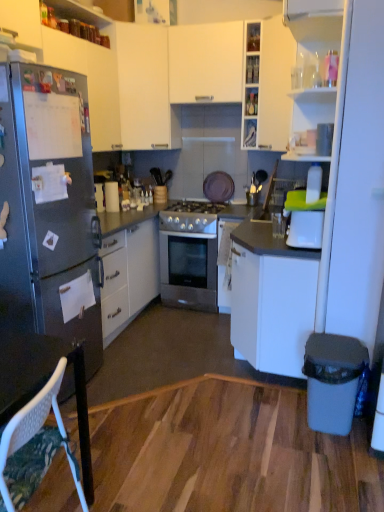
Question: From a real-world perspective, is white plastic trash can at lower right beneath white matte cabinet at upper center, which is the 1th cabinetry in right-to-left order?

Choices:
 (A) yes
 (B) no

Answer: (A)

Question: Is white matte cabinet at upper center, which is counted as the 4th cabinetry, starting from the left, located within white plastic trash can at lower right?

Choices:
 (A) yes
 (B) no

Answer: (B)

Question: Can you confirm if white plastic trash can at lower right is positioned to the left of white matte cabinet at upper center, which is counted as the 4th cabinetry, starting from the left?

Choices:
 (A) yes
 (B) no

Answer: (B)

Question: Would you say white plastic trash can at lower right is a long distance from white matte cabinet at upper center, which is the 1th cabinetry in right-to-left order?

Choices:
 (A) no
 (B) yes

Answer: (B)

Question: Is white plastic trash can at lower right oriented towards white matte cabinet at upper center, which is counted as the 4th cabinetry, starting from the left?

Choices:
 (A) no
 (B) yes

Answer: (A)

Question: In terms of size, does satin silver gas stove at center appear bigger or smaller than metallic silver cabinet at upper left, marked as the fourth cabinetry in a right-to-left arrangement?

Choices:
 (A) small
 (B) big

Answer: (A)

Question: Would you say satin silver gas stove at center is inside or outside metallic silver cabinet at upper left, the 1th cabinetry viewed from the left?

Choices:
 (A) outside
 (B) inside

Answer: (A)

Question: Is satin silver gas stove at center taller or shorter than metallic silver cabinet at upper left, marked as the fourth cabinetry in a right-to-left arrangement?

Choices:
 (A) tall
 (B) short

Answer: (B)

Question: Considering the relative positions of satin silver gas stove at center and metallic silver cabinet at upper left, the 1th cabinetry viewed from the left, in the image provided, is satin silver gas stove at center to the left or to the right of metallic silver cabinet at upper left, the 1th cabinetry viewed from the left,?

Choices:
 (A) right
 (B) left

Answer: (A)

Question: Choose the correct answer: Is clear glass bottles at upper center, the 1th shelf positioned from the top, inside clear glass shelf at upper center, the 1th shelf from the bottom, or outside it?

Choices:
 (A) inside
 (B) outside

Answer: (B)

Question: Would you say clear glass bottles at upper center, the 1th shelf positioned from the top, is to the left or to the right of clear glass shelf at upper center, marked as the second shelf in a top-to-bottom arrangement, in the picture?

Choices:
 (A) right
 (B) left

Answer: (B)

Question: From a real-world perspective, is clear glass bottles at upper center, the 1th shelf positioned from the top, physically located above or below clear glass shelf at upper center, marked as the second shelf in a top-to-bottom arrangement?

Choices:
 (A) above
 (B) below

Answer: (A)

Question: Is clear glass bottles at upper center, the 1th shelf positioned from the top, in front of or behind clear glass shelf at upper center, marked as the second shelf in a top-to-bottom arrangement, in the image?

Choices:
 (A) front
 (B) behind

Answer: (A)

Question: Would you say clear glass bottles at upper center, which ranks as the second shelf in bottom-to-top order, is to the left or to the right of white plastic trash can at lower right in the picture?

Choices:
 (A) right
 (B) left

Answer: (B)

Question: Would you say clear glass bottles at upper center, which ranks as the second shelf in bottom-to-top order, is inside or outside white plastic trash can at lower right?

Choices:
 (A) inside
 (B) outside

Answer: (B)